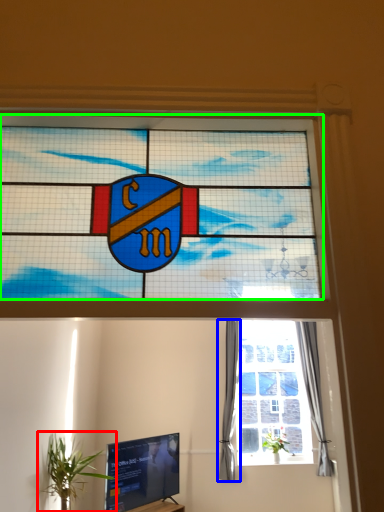
Question: Based on their relative distances, which object is nearer to houseplant (highlighted by a red box)? Choose from curtain (highlighted by a blue box) and window (highlighted by a green box).

Choices:
 (A) curtain
 (B) window

Answer: (A)